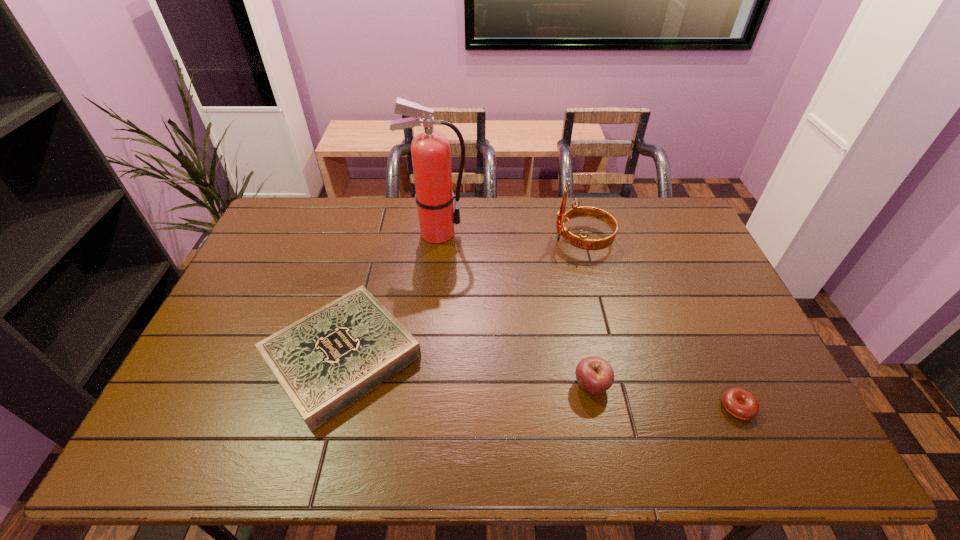
Find the location of a particular element. This screenshot has width=960, height=540. free region located on the side of the third tallest object with the unique marking is located at coordinates (485, 385).

Find the location of a particular element. The image size is (960, 540). vacant space located on the side of the third tallest object with the unique marking is located at coordinates (458, 385).

I want to click on vacant area located 0.330m on the side of the third tallest object with the unique marking, so click(446, 385).

Locate an element on the screen. free region located on the right of the hardback book is located at coordinates (567, 356).

Where is `vacant region located 0.400m on the back of the shortest object`? vacant region located 0.400m on the back of the shortest object is located at coordinates (681, 281).

At what (x,y) coordinates should I click in order to perform the action: click on fire extinguisher located in the far edge section of the desktop. Please return your answer as a coordinate pair (x, y). Looking at the image, I should click on (431, 156).

Where is `tiara at the far edge`? tiara at the far edge is located at coordinates (580, 242).

The width and height of the screenshot is (960, 540). In order to click on object at the near edge in this screenshot , I will do `click(324, 362)`.

Locate an element on the screen. The height and width of the screenshot is (540, 960). object that is at the right edge is located at coordinates (748, 408).

Where is `free region at the far edge`? The width and height of the screenshot is (960, 540). free region at the far edge is located at coordinates (348, 211).